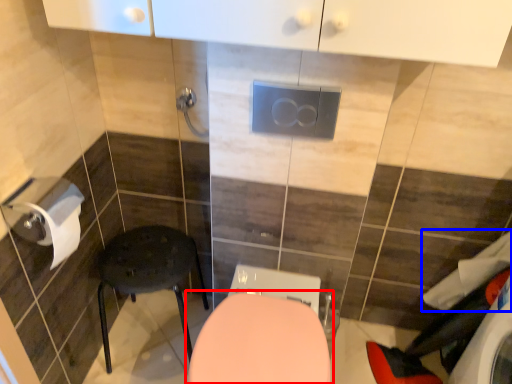
Question: Which object is further to the camera taking this photo, toilet (highlighted by a red box) or laundry (highlighted by a blue box)?

Choices:
 (A) toilet
 (B) laundry

Answer: (B)